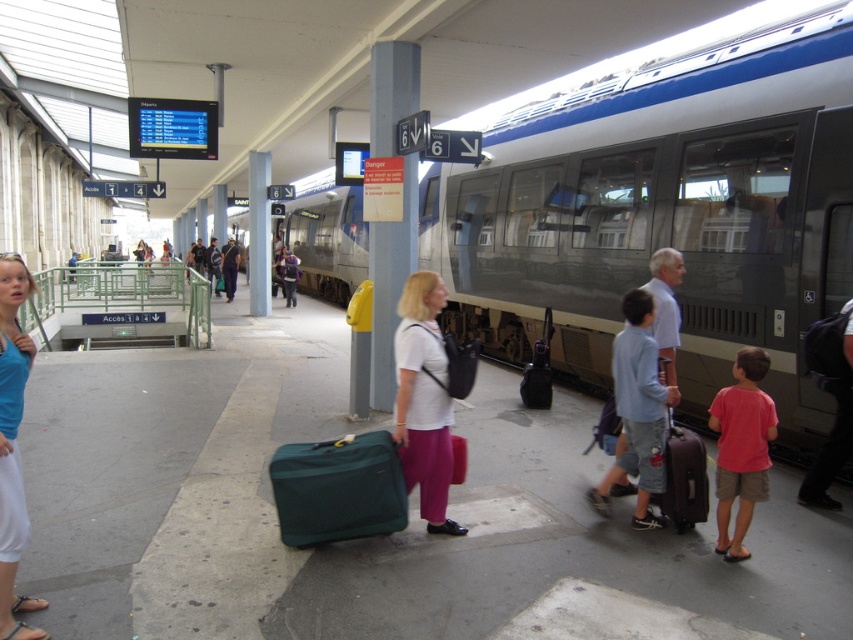
You are a traveler standing on the platform and need to place your green fabric suitcase at center next to the metallic gray pillar at center. Considering their sizes, will the suitcase fit comfortably next to the pillar without blocking the walkway?

The green fabric suitcase at center is smaller than the metallic gray pillar at center, so it will fit comfortably next to the pillar without blocking the walkway.

You are standing on the train station platform and want to determine the relative positions of two points marked in the image. Which point, point (4, 561) or point (263, 228), is closer to you?

Point (4, 561) is closer to the viewer than point (263, 228).